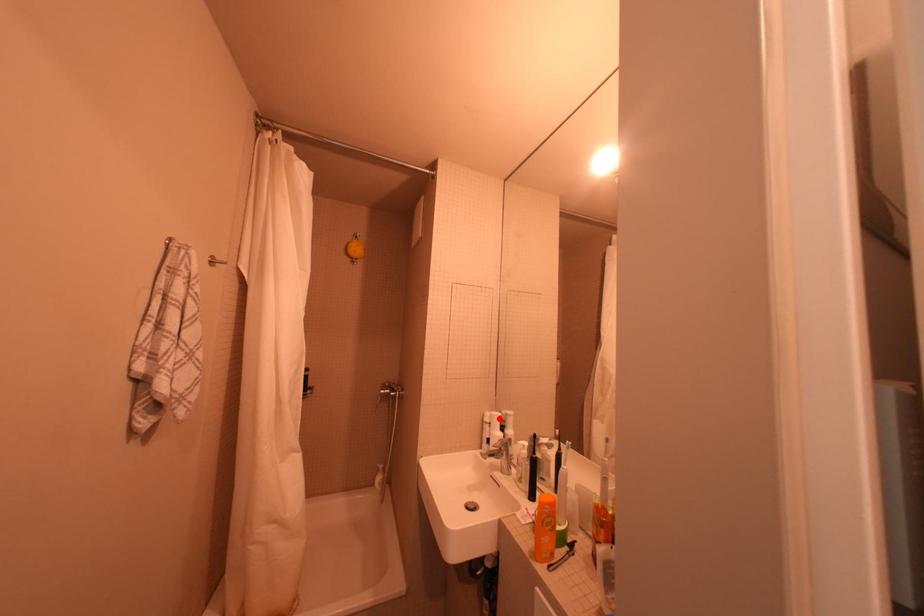
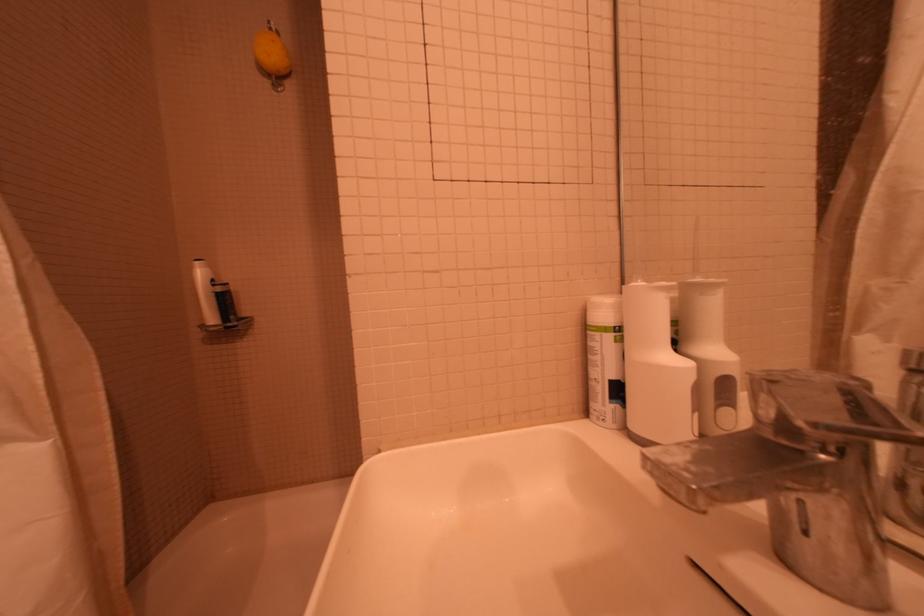
Find the pixel in the second image that matches the highlighted location in the first image.

(627, 309)